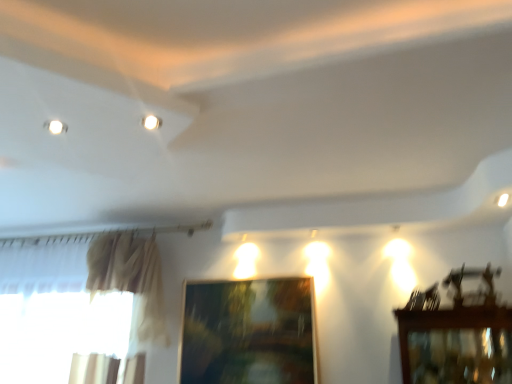
Question: From a real-world perspective, is white glossy light at upper right under white glossy light fixture at upper center?

Choices:
 (A) no
 (B) yes

Answer: (B)

Question: Does white glossy light at upper right have a greater height compared to white glossy light fixture at upper center?

Choices:
 (A) yes
 (B) no

Answer: (A)

Question: Does white glossy light at upper right have a smaller size compared to white glossy light fixture at upper center?

Choices:
 (A) no
 (B) yes

Answer: (A)

Question: Is white glossy light at upper right facing towards white glossy light fixture at upper center?

Choices:
 (A) no
 (B) yes

Answer: (A)

Question: Is white glossy light at upper right bigger than white glossy light fixture at upper center?

Choices:
 (A) yes
 (B) no

Answer: (A)

Question: In the image, is wooden picture frame at center positioned in front of or behind white glossy light fixture at upper center?

Choices:
 (A) behind
 (B) front

Answer: (A)

Question: Looking at their shapes, would you say wooden picture frame at center is wider or thinner than white glossy light fixture at upper center?

Choices:
 (A) thin
 (B) wide

Answer: (A)

Question: Choose the correct answer: Is wooden picture frame at center inside white glossy light fixture at upper center or outside it?

Choices:
 (A) outside
 (B) inside

Answer: (A)

Question: From a real-world perspective, is wooden picture frame at center above or below white glossy light fixture at upper center?

Choices:
 (A) above
 (B) below

Answer: (B)

Question: In terms of height, does wooden picture frame at center look taller or shorter compared to white glossy light at upper right?

Choices:
 (A) short
 (B) tall

Answer: (B)

Question: Considering the positions of point (198, 372) and point (502, 193), is point (198, 372) closer or farther from the camera than point (502, 193)?

Choices:
 (A) farther
 (B) closer

Answer: (A)

Question: Is wooden picture frame at center inside the boundaries of white glossy light at upper right, or outside?

Choices:
 (A) outside
 (B) inside

Answer: (A)

Question: Visually, is wooden picture frame at center positioned to the left or to the right of white glossy light at upper right?

Choices:
 (A) left
 (B) right

Answer: (A)

Question: From the image's perspective, is white glossy light at upper right above or below white glossy light fixture at upper center?

Choices:
 (A) above
 (B) below

Answer: (B)

Question: Is point (504, 195) closer or farther from the camera than point (147, 122)?

Choices:
 (A) closer
 (B) farther

Answer: (B)